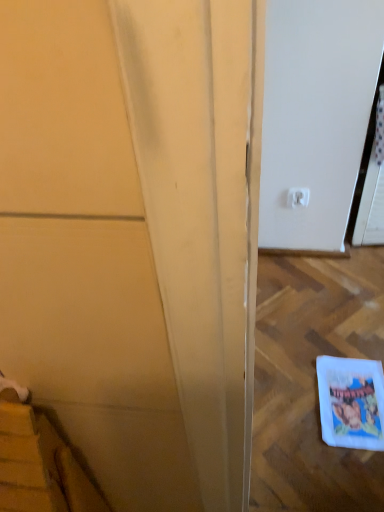
Question: From a real-world perspective, is matte yellow door at left physically above white plastic electric outlet at upper right?

Choices:
 (A) no
 (B) yes

Answer: (B)

Question: Does matte yellow door at left have a larger size compared to white plastic electric outlet at upper right?

Choices:
 (A) no
 (B) yes

Answer: (B)

Question: Is matte yellow door at left not within white plastic electric outlet at upper right?

Choices:
 (A) yes
 (B) no

Answer: (A)

Question: From the image's perspective, is matte yellow door at left under white plastic electric outlet at upper right?

Choices:
 (A) no
 (B) yes

Answer: (B)

Question: Is matte yellow door at left at the right side of white plastic electric outlet at upper right?

Choices:
 (A) no
 (B) yes

Answer: (A)

Question: From the image's perspective, is matte yellow door at left positioned above or below white paper comic book at lower right?

Choices:
 (A) below
 (B) above

Answer: (B)

Question: Based on their positions, is matte yellow door at left located to the left or right of white paper comic book at lower right?

Choices:
 (A) left
 (B) right

Answer: (A)

Question: Considering the positions of matte yellow door at left and white paper comic book at lower right in the image, is matte yellow door at left bigger or smaller than white paper comic book at lower right?

Choices:
 (A) small
 (B) big

Answer: (B)

Question: Is matte yellow door at left wider or thinner than white paper comic book at lower right?

Choices:
 (A) thin
 (B) wide

Answer: (A)

Question: In the image, is white plastic electric outlet at upper right positioned in front of or behind matte yellow door at left?

Choices:
 (A) front
 (B) behind

Answer: (B)

Question: Does point (306, 194) appear closer or farther from the camera than point (72, 160)?

Choices:
 (A) closer
 (B) farther

Answer: (B)

Question: Choose the correct answer: Is white plastic electric outlet at upper right inside matte yellow door at left or outside it?

Choices:
 (A) inside
 (B) outside

Answer: (B)

Question: From a real-world perspective, is white plastic electric outlet at upper right above or below matte yellow door at left?

Choices:
 (A) above
 (B) below

Answer: (B)

Question: Is point (96, 71) closer or farther from the camera than point (301, 189)?

Choices:
 (A) closer
 (B) farther

Answer: (A)

Question: Is matte yellow door at left inside or outside of white plastic electric outlet at upper right?

Choices:
 (A) outside
 (B) inside

Answer: (A)